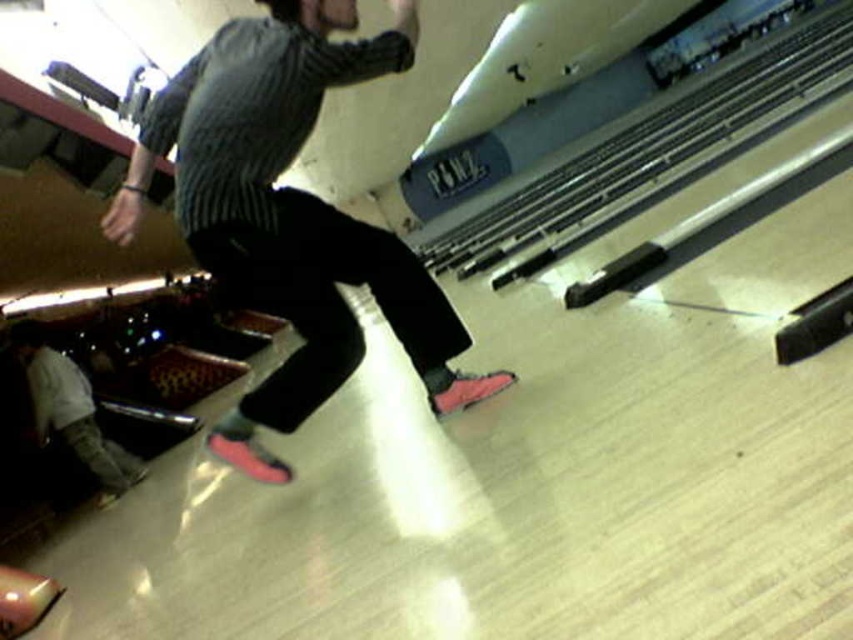
Question: Is pink suede sneakers at center wider than camouflage pants at lower left?

Choices:
 (A) no
 (B) yes

Answer: (A)

Question: Does pink suede sneakers at center come in front of camouflage pants at lower left?

Choices:
 (A) yes
 (B) no

Answer: (A)

Question: Is pink suede sneakers at center thinner than camouflage pants at lower left?

Choices:
 (A) no
 (B) yes

Answer: (B)

Question: Which of the following is the farthest from the observer?

Choices:
 (A) (76, 442)
 (B) (131, 193)

Answer: (A)

Question: Which object appears closest to the camera in this image?

Choices:
 (A) pink suede sneakers at center
 (B) camouflage pants at lower left

Answer: (A)